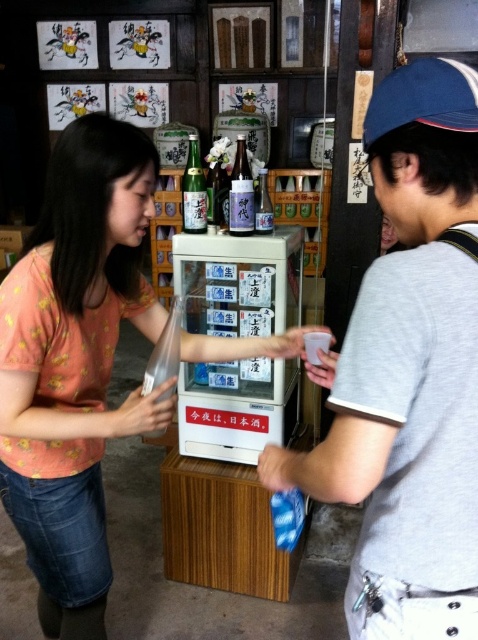
Does point (33, 378) lie in front of point (466, 77)?

No.

Describe the element at coordinates (76, 362) in the screenshot. I see `matte pink shirt at center` at that location.

I want to click on matte pink shirt at center, so tap(76, 362).

Does gray cotton t-shirt at center lie behind blue fabric baseball cap at upper right?

No, it is in front of blue fabric baseball cap at upper right.

Who is more distant from viewer, (446, 349) or (386, 124)?

The point (386, 124) is more distant.

At what (x,y) coordinates should I click in order to perform the action: click on gray cotton t-shirt at center. Please return your answer as a coordinate pair (x, y). The image size is (478, 640). Looking at the image, I should click on (409, 372).

Does gray cotton t-shirt at center have a lesser width compared to shiny silver bottle at center?

Incorrect, gray cotton t-shirt at center's width is not less than shiny silver bottle at center's.

This screenshot has width=478, height=640. I want to click on gray cotton t-shirt at center, so click(409, 372).

The width and height of the screenshot is (478, 640). What are the coordinates of `gray cotton t-shirt at center` in the screenshot? It's located at (409, 372).

What are the coordinates of `gray cotton t-shirt at center` in the screenshot? It's located at (409, 372).